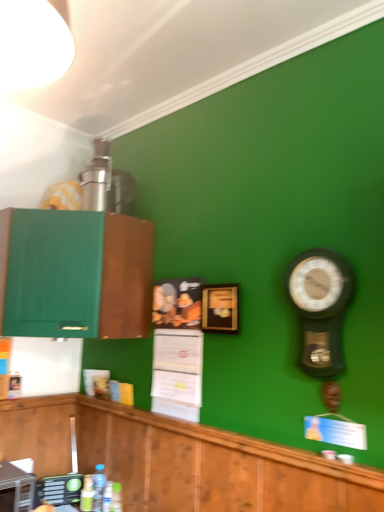
Question: Does metallic silver toaster at lower left, positioned as the first appliance in front-to-back order, come in front of translucent plastic bottles at lower center, the 4th bottle when ordered from left to right?

Choices:
 (A) yes
 (B) no

Answer: (A)

Question: Is metallic silver toaster at lower left, positioned as the first appliance in front-to-back order, shorter than translucent plastic bottles at lower center, the 4th bottle when ordered from left to right?

Choices:
 (A) no
 (B) yes

Answer: (A)

Question: Does metallic silver toaster at lower left, which is counted as the second appliance, starting from the back, have a larger size compared to translucent plastic bottles at lower center, the 4th bottle when ordered from left to right?

Choices:
 (A) no
 (B) yes

Answer: (B)

Question: From the image's perspective, is metallic silver toaster at lower left, which is counted as the second appliance, starting from the back, beneath translucent plastic bottles at lower center, the 4th bottle when ordered from left to right?

Choices:
 (A) yes
 (B) no

Answer: (B)

Question: From the image's perspective, would you say metallic silver toaster at lower left, which is counted as the second appliance, starting from the back, is positioned over translucent plastic bottles at lower center, acting as the first bottle starting from the right?

Choices:
 (A) no
 (B) yes

Answer: (B)

Question: Looking at the image, does green matte cabinet at left, marked as the 1th cabinetry in a top-to-bottom arrangement, seem bigger or smaller compared to metallic pendulum clock at right?

Choices:
 (A) small
 (B) big

Answer: (B)

Question: Considering the relative positions of green matte cabinet at left, which appears as the 2th cabinetry when ordered from the bottom, and metallic pendulum clock at right in the image provided, is green matte cabinet at left, which appears as the 2th cabinetry when ordered from the bottom, to the left or to the right of metallic pendulum clock at right?

Choices:
 (A) left
 (B) right

Answer: (A)

Question: From a real-world perspective, is green matte cabinet at left, which appears as the 2th cabinetry when ordered from the bottom, physically located above or below metallic pendulum clock at right?

Choices:
 (A) below
 (B) above

Answer: (B)

Question: Is green matte cabinet at left, marked as the 1th cabinetry in a top-to-bottom arrangement, taller or shorter than metallic pendulum clock at right?

Choices:
 (A) tall
 (B) short

Answer: (A)

Question: Considering the positions of green matte bottle at lower left, which ranks as the 4th bottle in right-to-left order, and green matte cabinet at left, which appears as the 2th cabinetry when ordered from the bottom, in the image, is green matte bottle at lower left, which ranks as the 4th bottle in right-to-left order, bigger or smaller than green matte cabinet at left, which appears as the 2th cabinetry when ordered from the bottom,?

Choices:
 (A) small
 (B) big

Answer: (A)

Question: From a real-world perspective, is green matte bottle at lower left, placed as the 1th bottle when sorted from left to right, physically located above or below green matte cabinet at left, marked as the 1th cabinetry in a top-to-bottom arrangement?

Choices:
 (A) below
 (B) above

Answer: (A)

Question: Does point (91, 497) appear closer or farther from the camera than point (56, 321)?

Choices:
 (A) farther
 (B) closer

Answer: (A)

Question: Considering the positions of green matte bottle at lower left, placed as the 1th bottle when sorted from left to right, and green matte cabinet at left, which appears as the 2th cabinetry when ordered from the bottom, in the image, is green matte bottle at lower left, placed as the 1th bottle when sorted from left to right, taller or shorter than green matte cabinet at left, which appears as the 2th cabinetry when ordered from the bottom,?

Choices:
 (A) short
 (B) tall

Answer: (A)

Question: From a real-world perspective, is metallic silver toaster at lower left, which is counted as the second appliance, starting from the back, positioned above or below translucent plastic bottles at lower center, acting as the first bottle starting from the right?

Choices:
 (A) below
 (B) above

Answer: (B)

Question: Is metallic silver toaster at lower left, positioned as the first appliance in front-to-back order, wider or thinner than translucent plastic bottles at lower center, the 4th bottle when ordered from left to right?

Choices:
 (A) wide
 (B) thin

Answer: (A)